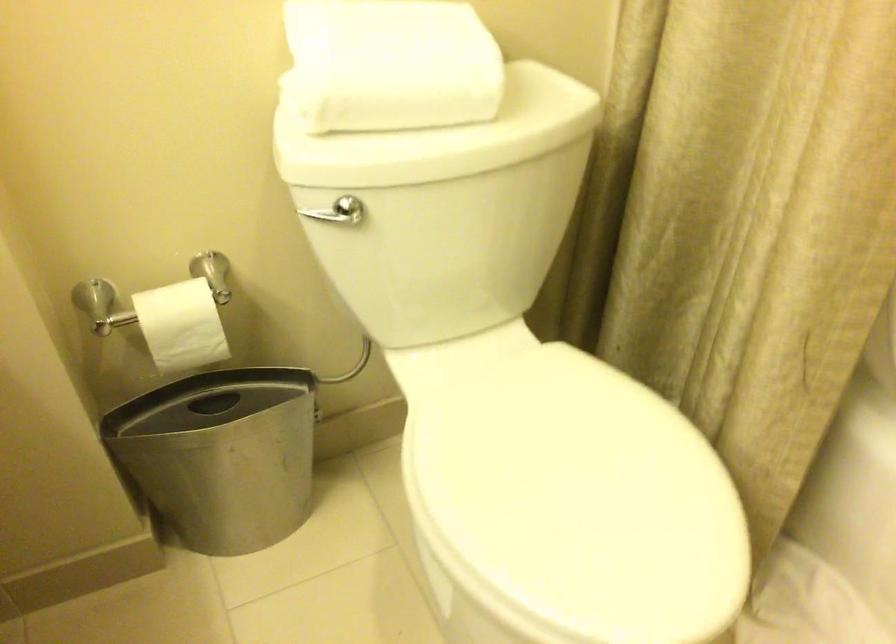
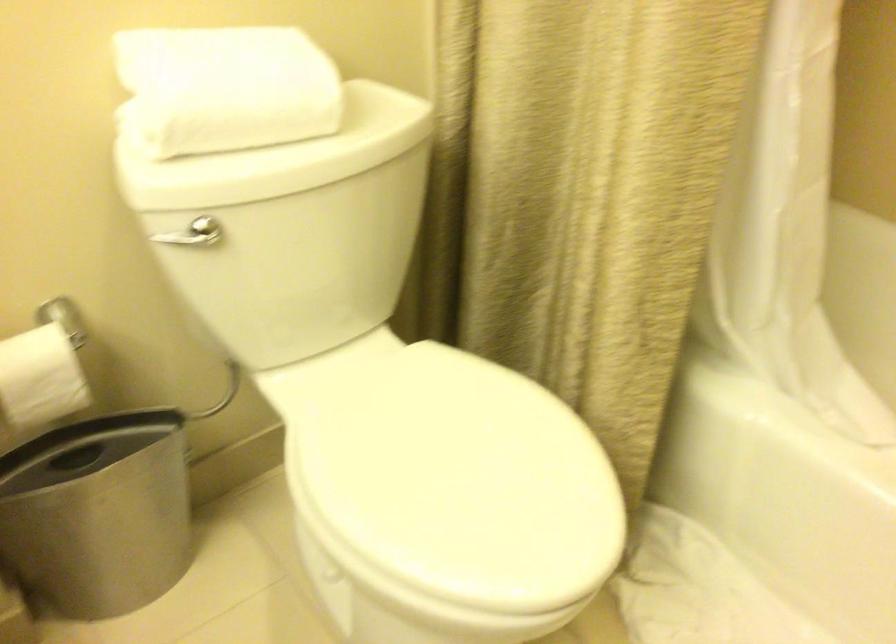
Find the pixel in the second image that matches the point at 550,505 in the first image.

(442, 485)